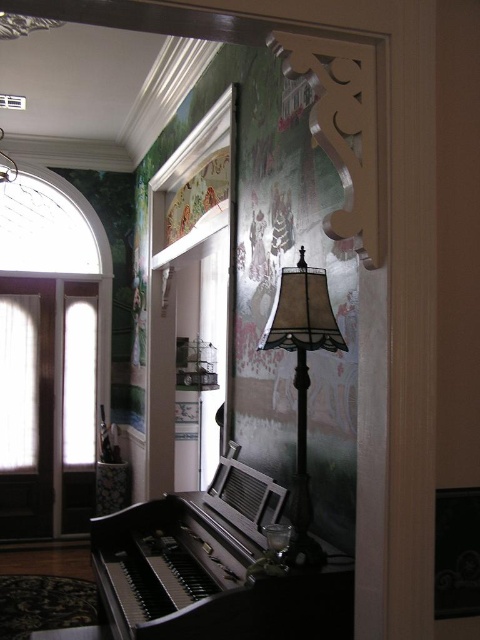
Question: Does black polished piano at lower left appear on the left side of matte beige lampshade at center?

Choices:
 (A) yes
 (B) no

Answer: (A)

Question: Is black polished piano at lower left smaller than matte beige lampshade at center?

Choices:
 (A) yes
 (B) no

Answer: (B)

Question: Can you confirm if black polished piano at lower left is wider than matte beige lampshade at center?

Choices:
 (A) no
 (B) yes

Answer: (B)

Question: Among these points, which one is farthest from the camera?

Choices:
 (A) (297, 538)
 (B) (203, 557)

Answer: (B)